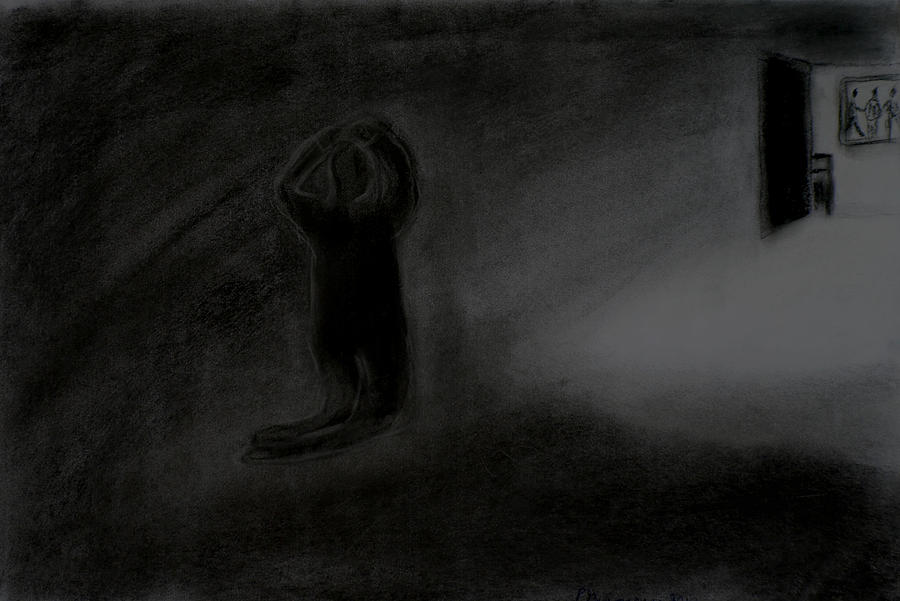
This screenshot has height=601, width=900. Identify the location of picture. (862, 95).